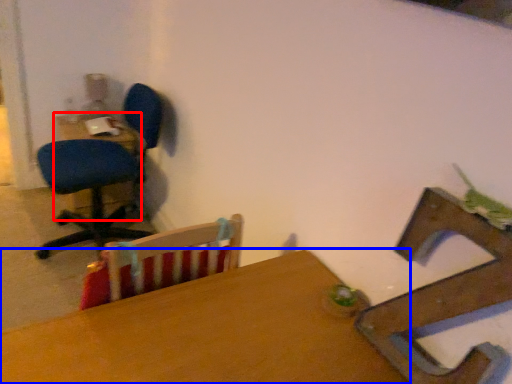
Question: Which object appears closest to the camera in this image, table (highlighted by a red box) or table (highlighted by a blue box)?

Choices:
 (A) table
 (B) table

Answer: (B)